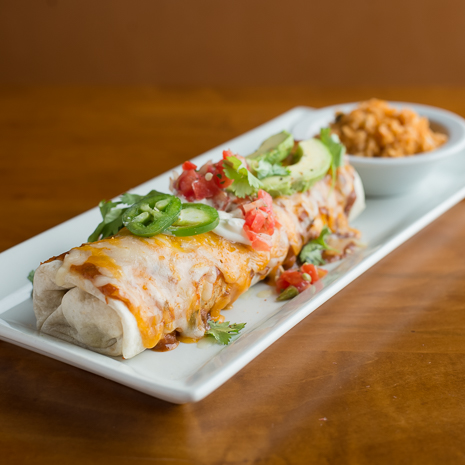
You are a GUI agent. You are given a task and a screenshot of the screen. Output one action in this format:
    pyautogui.click(x=<x>, y=<y>)
    Task: Click on the wooden table
    The image size is (465, 465).
    Given the screenshot: What is the action you would take?
    pyautogui.click(x=367, y=359)